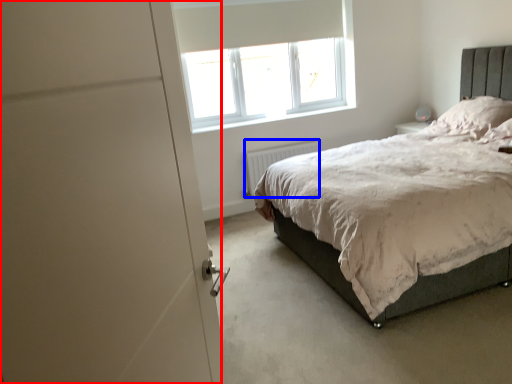
Question: Which object is closer to the camera taking this photo, screen door (highlighted by a red box) or radiator (highlighted by a blue box)?

Choices:
 (A) screen door
 (B) radiator

Answer: (A)